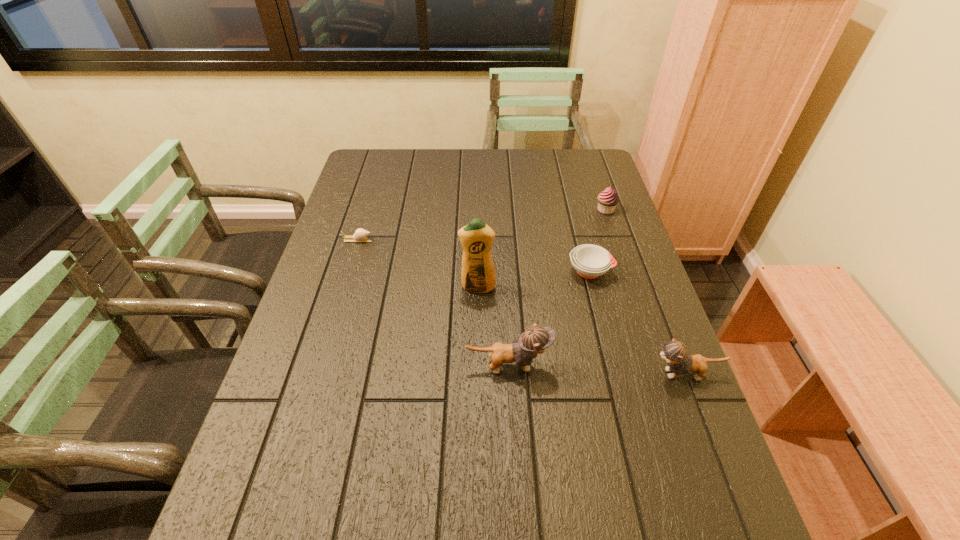
Identify the location of the tallest object. The height and width of the screenshot is (540, 960). (478, 273).

I want to click on free space located on the front-facing side of the fifth shortest object, so click(x=628, y=366).

Image resolution: width=960 pixels, height=540 pixels. Find the location of `blank area located on the front-facing side of the fourth shortest object`. blank area located on the front-facing side of the fourth shortest object is located at coordinates (618, 374).

The image size is (960, 540). Find the location of `free location located 0.260m on the front-facing side of the fourth shortest object`. free location located 0.260m on the front-facing side of the fourth shortest object is located at coordinates (536, 374).

Where is `vacant region located on the front-facing side of the fourth shortest object`? vacant region located on the front-facing side of the fourth shortest object is located at coordinates (474, 374).

I want to click on vacant space situated 0.170m on the back of the cupcake, so click(x=594, y=176).

Find the location of a particular element. The width and height of the screenshot is (960, 540). free space located on the shell of the shortest object is located at coordinates (438, 240).

The image size is (960, 540). In order to click on free space located on the front of the second shortest object in this screenshot , I will do `click(622, 398)`.

Find the location of a particular element. The height and width of the screenshot is (540, 960). free spot located on the label of the detergent is located at coordinates (477, 375).

You are a GUI agent. You are given a task and a screenshot of the screen. Output one action in this format:
    pyautogui.click(x=<x>, y=<y>)
    Task: Click on the object at the left edge
    The image size is (960, 540).
    Given the screenshot: What is the action you would take?
    pyautogui.click(x=360, y=235)